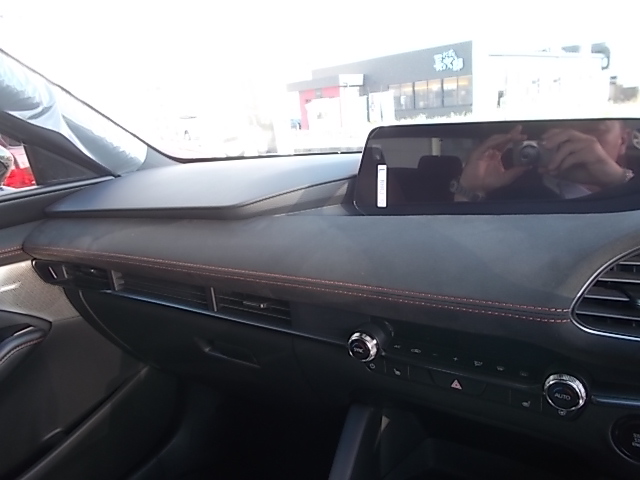
What are the coordinates of `mirror` in the screenshot? It's located at (413, 151).